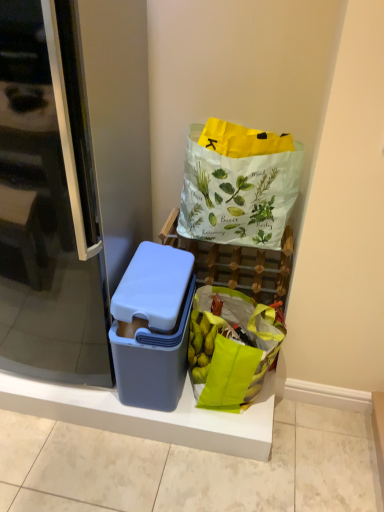
Locate an element on the screen. The width and height of the screenshot is (384, 512). vacant area that is in front of matte plastic container at left is located at coordinates (x=110, y=471).